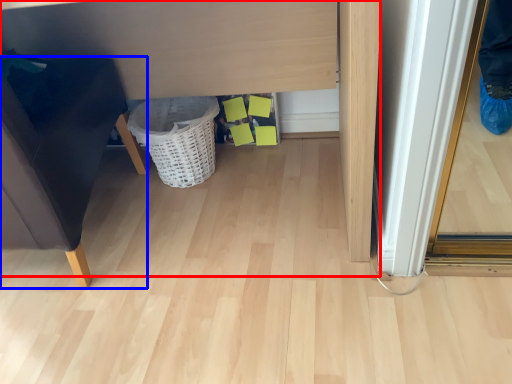
Question: Among these objects, which one is farthest to the camera, vanity (highlighted by a red box) or furniture (highlighted by a blue box)?

Choices:
 (A) vanity
 (B) furniture

Answer: (A)